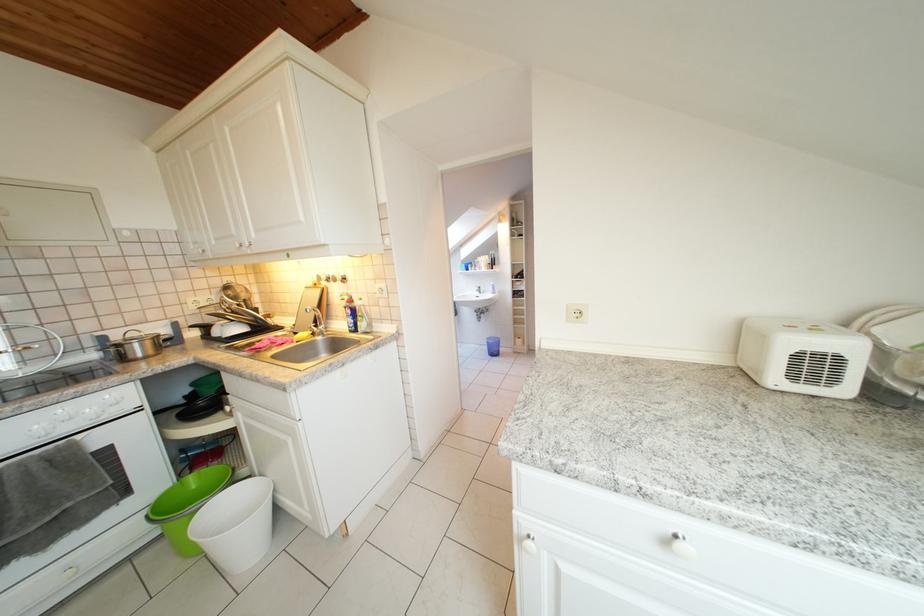
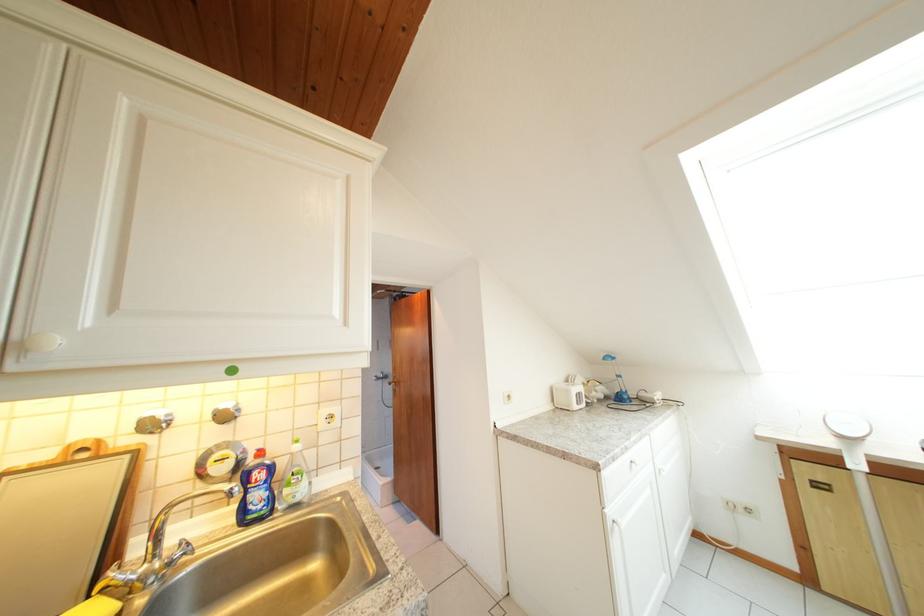
Find the pixel in the second image that matches [368,329] in the first image.

(295, 496)